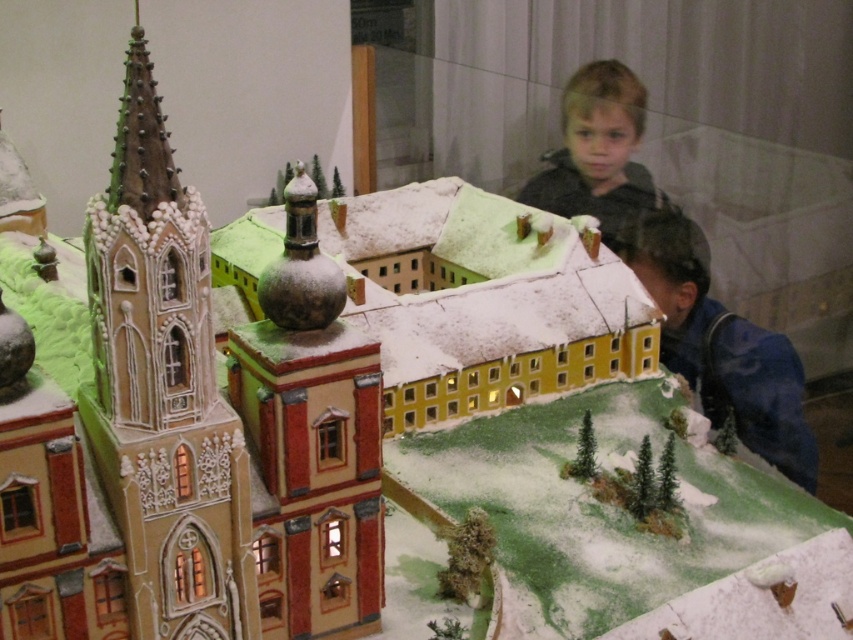
You are a visitor standing at the entrance of the historical building complex. You see a blue fabric jacket at lower right and a blonde hair boy at upper right. Which object is closer to you?

The blue fabric jacket at lower right is closer to you since it is only 5.88 meters away from the blonde hair boy at upper right, implying it is nearer in the scene.

You are an observer standing in front of the miniature model. You notice the blue fabric jacket at lower right and the blonde hair boy at upper right. Which object is wider?

The blue fabric jacket at lower right is wider than the blonde hair boy at upper right.

You are a visitor at the miniature model of the historical building complex. You see a blue fabric jacket at lower right and a blonde hair boy at upper right. Which object is positioned lower in the image?

The blue fabric jacket at lower right is positioned lower than the blonde hair boy at upper right.